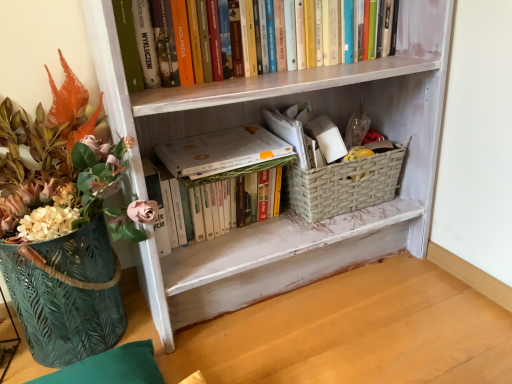
Question: Is green textured basket at left with white painted wood bookcase at center?

Choices:
 (A) yes
 (B) no

Answer: (B)

Question: Is green textured basket at left positioned with its back to white painted wood bookcase at center?

Choices:
 (A) yes
 (B) no

Answer: (B)

Question: Is green textured basket at left smaller than white painted wood bookcase at center?

Choices:
 (A) no
 (B) yes

Answer: (B)

Question: Is the position of green textured basket at left more distant than that of white painted wood bookcase at center?

Choices:
 (A) yes
 (B) no

Answer: (B)

Question: Considering the relative sizes of green textured basket at left and white painted wood bookcase at center in the image provided, is green textured basket at left shorter than white painted wood bookcase at center?

Choices:
 (A) no
 (B) yes

Answer: (B)

Question: From a real-world perspective, is green textured basket at left located beneath white painted wood bookcase at center?

Choices:
 (A) yes
 (B) no

Answer: (A)

Question: Is green textured basket at left positioned beyond the bounds of white matte book at center, positioned as the second book in top-to-bottom order?

Choices:
 (A) yes
 (B) no

Answer: (A)

Question: From the image's perspective, is green textured basket at left below white matte book at center, which is the 1th book in bottom-to-top order?

Choices:
 (A) no
 (B) yes

Answer: (B)

Question: Does green textured basket at left have a smaller size compared to white matte book at center, which is the 1th book in bottom-to-top order?

Choices:
 (A) no
 (B) yes

Answer: (A)

Question: Considering the relative sizes of green textured basket at left and white matte book at center, which is the 1th book in bottom-to-top order, in the image provided, is green textured basket at left bigger than white matte book at center, which is the 1th book in bottom-to-top order,?

Choices:
 (A) yes
 (B) no

Answer: (A)

Question: Does green textured basket at left appear on the right side of white matte book at center, which is the 1th book in bottom-to-top order?

Choices:
 (A) yes
 (B) no

Answer: (B)

Question: Is white matte book at center, which is the 1th book in bottom-to-top order, surrounded by green textured basket at left?

Choices:
 (A) yes
 (B) no

Answer: (B)

Question: From the image's perspective, does woven beige basket at lower center appear higher than white painted wood bookcase at center?

Choices:
 (A) no
 (B) yes

Answer: (A)